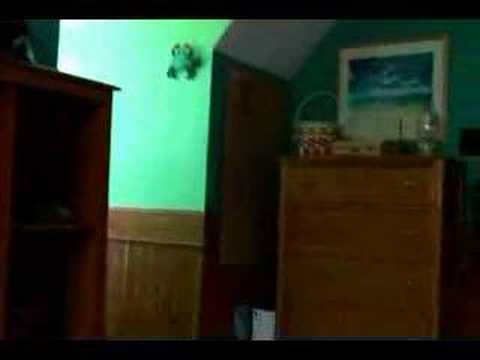
Identify the location of shelves. (92, 185), (84, 313).